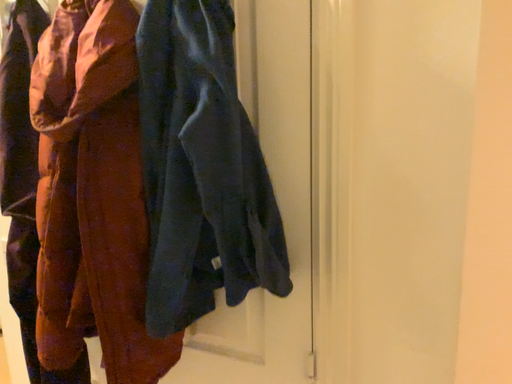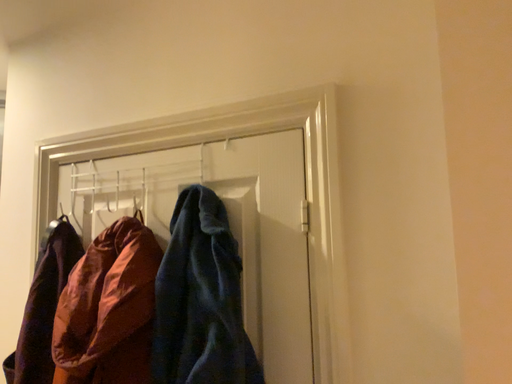
Question: Which way did the camera rotate in the video?

Choices:
 (A) rotated upward
 (B) rotated downward

Answer: (A)